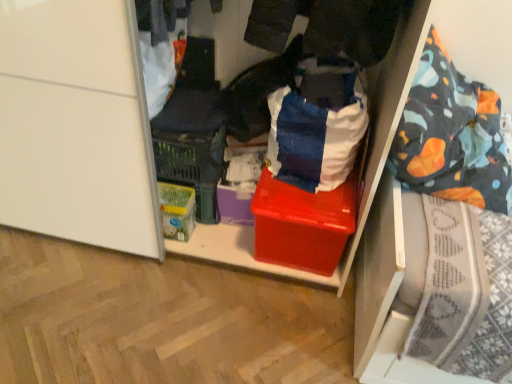
Question: Should I look upward or downward to see white cotton shirt at upper left, arranged as the second clothing when viewed from the right?

Choices:
 (A) up
 (B) down

Answer: (A)

Question: Considering the relative sizes of blue cotton shirt at center, which appears as the first clothing when viewed from the right, and white cotton shirt at upper left, arranged as the second clothing when viewed from the right, in the image provided, is blue cotton shirt at center, which appears as the first clothing when viewed from the right, smaller than white cotton shirt at upper left, arranged as the second clothing when viewed from the right,?

Choices:
 (A) no
 (B) yes

Answer: (A)

Question: From a real-world perspective, is blue cotton shirt at center, positioned as the 2th clothing in left-to-right order, located beneath white cotton shirt at upper left, the first clothing positioned from the left?

Choices:
 (A) yes
 (B) no

Answer: (A)

Question: Does blue cotton shirt at center, positioned as the 2th clothing in left-to-right order, have a greater width compared to white cotton shirt at upper left, arranged as the second clothing when viewed from the right?

Choices:
 (A) yes
 (B) no

Answer: (B)

Question: Does blue cotton shirt at center, which appears as the first clothing when viewed from the right, come behind white cotton shirt at upper left, the first clothing positioned from the left?

Choices:
 (A) no
 (B) yes

Answer: (B)

Question: Is blue cotton shirt at center, positioned as the 2th clothing in left-to-right order, touching white cotton shirt at upper left, arranged as the second clothing when viewed from the right?

Choices:
 (A) no
 (B) yes

Answer: (A)

Question: Does blue cotton shirt at center, which appears as the first clothing when viewed from the right, have a greater height compared to white cotton shirt at upper left, arranged as the second clothing when viewed from the right?

Choices:
 (A) no
 (B) yes

Answer: (A)

Question: From a real-world perspective, is blue cotton shirt at center, which appears as the first clothing when viewed from the right, over shiny plastic box at center?

Choices:
 (A) yes
 (B) no

Answer: (A)

Question: Could you tell me if blue cotton shirt at center, which appears as the first clothing when viewed from the right, is turned towards shiny plastic box at center?

Choices:
 (A) no
 (B) yes

Answer: (A)

Question: Considering the relative sizes of blue cotton shirt at center, which appears as the first clothing when viewed from the right, and shiny plastic box at center in the image provided, is blue cotton shirt at center, which appears as the first clothing when viewed from the right, bigger than shiny plastic box at center?

Choices:
 (A) no
 (B) yes

Answer: (A)

Question: Is shiny plastic box at center located within blue cotton shirt at center, positioned as the 2th clothing in left-to-right order?

Choices:
 (A) yes
 (B) no

Answer: (B)

Question: Are blue cotton shirt at center, positioned as the 2th clothing in left-to-right order, and shiny plastic box at center far apart?

Choices:
 (A) no
 (B) yes

Answer: (A)

Question: Does blue cotton shirt at center, positioned as the 2th clothing in left-to-right order, have a greater height compared to shiny plastic box at center?

Choices:
 (A) no
 (B) yes

Answer: (B)

Question: Is shiny plastic box at center to the right of white cotton shirt at upper left, arranged as the second clothing when viewed from the right, from the viewer's perspective?

Choices:
 (A) yes
 (B) no

Answer: (A)